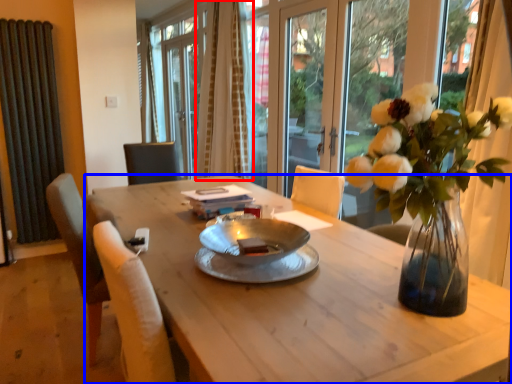
Question: Which object is further to the camera taking this photo, curtain (highlighted by a red box) or desk (highlighted by a blue box)?

Choices:
 (A) curtain
 (B) desk

Answer: (A)